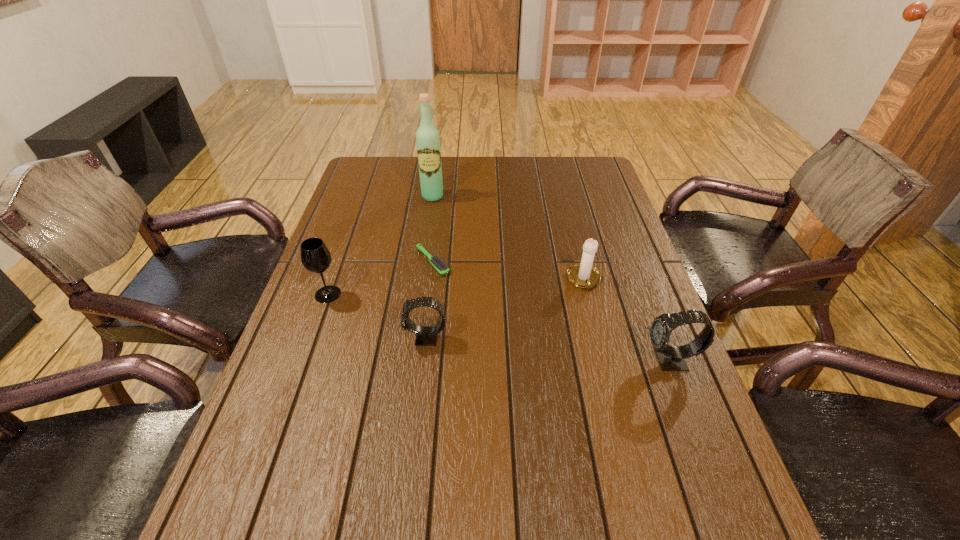
If equal spacing is desired by inserting an extra watch among them, please point out a free spot for this new watch. Please provide its 2D coordinates. Your answer should be formatted as a tuple, i.e. [(x, y)], where the tuple contains the x and y coordinates of a point satisfying the conditions above.

[(545, 349)]